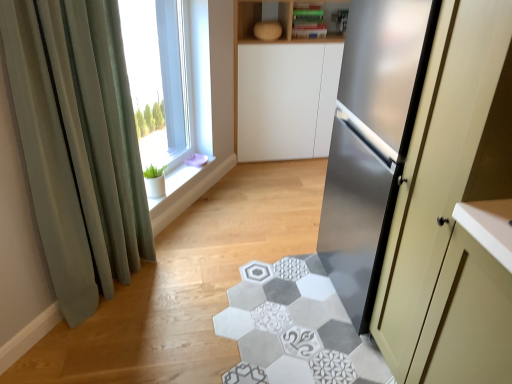
Question: From the image's perspective, is white ceramic window sill at upper left above satin silver refrigerator at right?

Choices:
 (A) yes
 (B) no

Answer: (A)

Question: Does white ceramic window sill at upper left come behind satin silver refrigerator at right?

Choices:
 (A) yes
 (B) no

Answer: (A)

Question: Does white ceramic window sill at upper left have a larger size compared to satin silver refrigerator at right?

Choices:
 (A) no
 (B) yes

Answer: (A)

Question: Considering the relative positions of white ceramic window sill at upper left and satin silver refrigerator at right in the image provided, is white ceramic window sill at upper left to the right of satin silver refrigerator at right from the viewer's perspective?

Choices:
 (A) no
 (B) yes

Answer: (A)

Question: Are white ceramic window sill at upper left and satin silver refrigerator at right located far from each other?

Choices:
 (A) yes
 (B) no

Answer: (A)

Question: From a real-world perspective, is white ceramic window sill at upper left positioned under satin silver refrigerator at right based on gravity?

Choices:
 (A) yes
 (B) no

Answer: (A)

Question: Is the surface of satin silver refrigerator at right in direct contact with green fabric curtain at left?

Choices:
 (A) yes
 (B) no

Answer: (B)

Question: Could green fabric curtain at left be considered to be inside satin silver refrigerator at right?

Choices:
 (A) yes
 (B) no

Answer: (B)

Question: From a real-world perspective, does satin silver refrigerator at right sit lower than green fabric curtain at left?

Choices:
 (A) no
 (B) yes

Answer: (A)

Question: Considering the relative sizes of satin silver refrigerator at right and green fabric curtain at left in the image provided, is satin silver refrigerator at right bigger than green fabric curtain at left?

Choices:
 (A) yes
 (B) no

Answer: (A)

Question: Is satin silver refrigerator at right oriented towards green fabric curtain at left?

Choices:
 (A) no
 (B) yes

Answer: (B)

Question: Does satin silver refrigerator at right appear on the left side of green fabric curtain at left?

Choices:
 (A) no
 (B) yes

Answer: (A)

Question: Can you confirm if satin silver refrigerator at right is shorter than clear glass window at upper left?

Choices:
 (A) no
 (B) yes

Answer: (A)